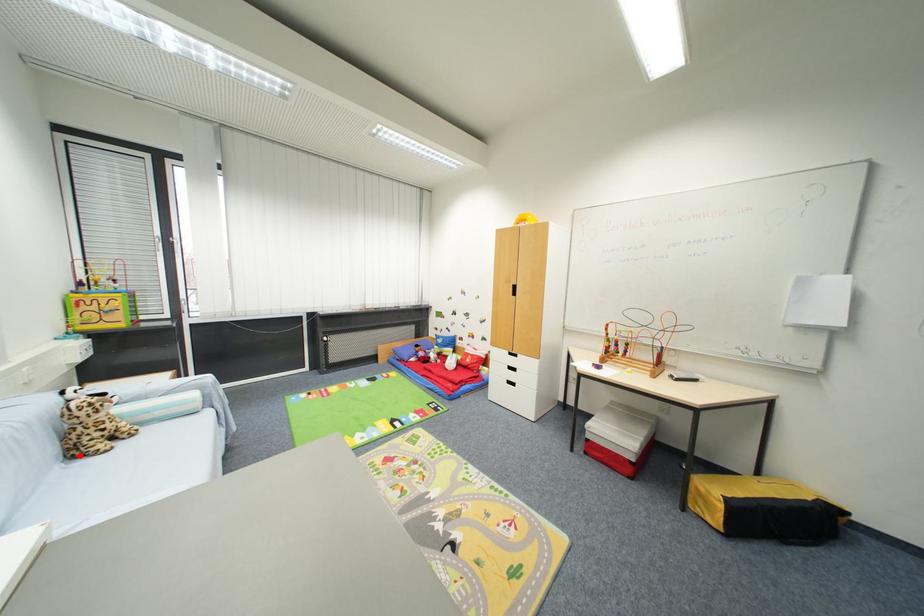
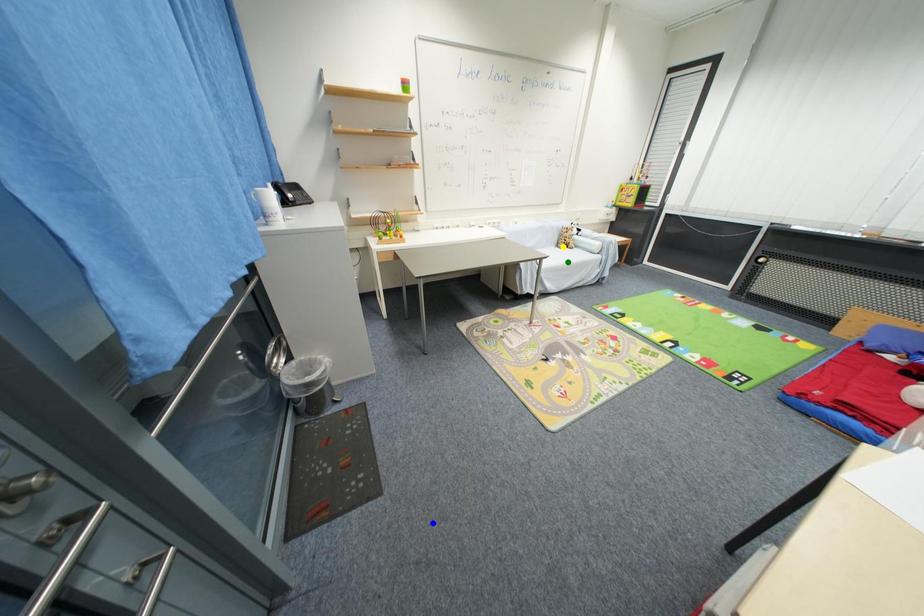
Question: I am providing you with two images of the same scene from different viewpoints. A red point is marked on the first image. You are given multiple points on the second image. Can you choose the point in image 2 that corresponds to the point in image 1?

Choices:
 (A) blue point
 (B) green point
 (C) yellow point

Answer: (C)